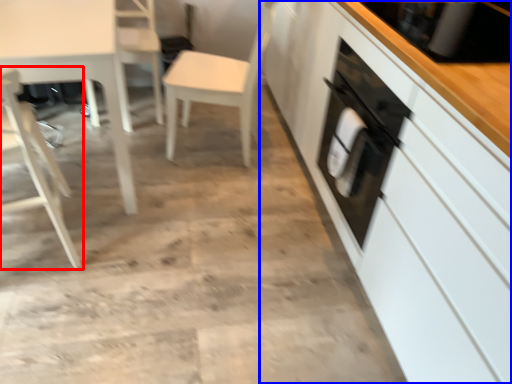
Question: Which of the following is the farthest to the observer, chair (highlighted by a red box) or cabinetry (highlighted by a blue box)?

Choices:
 (A) chair
 (B) cabinetry

Answer: (A)